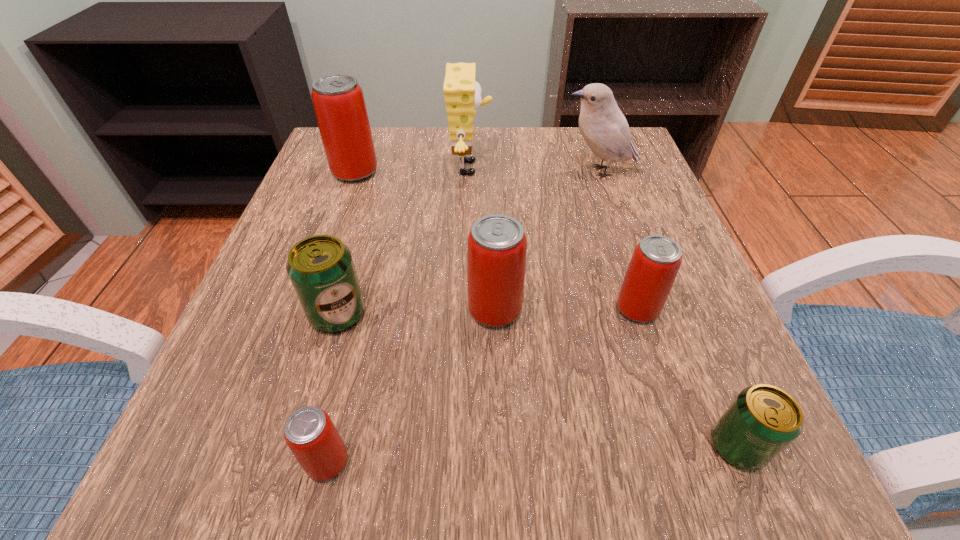
The image size is (960, 540). I want to click on vacant area that lies between the rightmost pink beer can and the white bird, so click(x=618, y=240).

Where is `vacant area that lies between the second smallest pink beer can and the second pink beer can from left to right`? vacant area that lies between the second smallest pink beer can and the second pink beer can from left to right is located at coordinates click(483, 386).

This screenshot has height=540, width=960. In order to click on empty space between the white bird and the sponge in this screenshot , I will do `click(535, 170)`.

This screenshot has width=960, height=540. I want to click on vacant area that lies between the smaller green beer can and the yellow sponge, so [604, 307].

Find the location of a particular element. free space between the fourth tallest object and the tallest beer can is located at coordinates (425, 241).

The height and width of the screenshot is (540, 960). I want to click on vacant point located between the nearer green beer can and the yellow sponge, so click(604, 307).

You are a GUI agent. You are given a task and a screenshot of the screen. Output one action in this format:
    pyautogui.click(x=<x>, y=<y>)
    Task: Click on the blank region between the third pink beer can from right to left and the left green beer can
    Image resolution: width=960 pixels, height=540 pixels.
    Given the screenshot: What is the action you would take?
    pyautogui.click(x=333, y=388)

The height and width of the screenshot is (540, 960). Find the location of `object that is the fourth closest to the biggest pink beer can`. object that is the fourth closest to the biggest pink beer can is located at coordinates (603, 126).

Identify the location of object that ranks as the third closest to the white bird. (496, 250).

Point out which beer can is positioned as the sixth nearest to the yellow sponge. Please provide its 2D coordinates. Your answer should be formatted as a tuple, i.e. [(x, y)], where the tuple contains the x and y coordinates of a point satisfying the conditions above.

[(763, 420)]